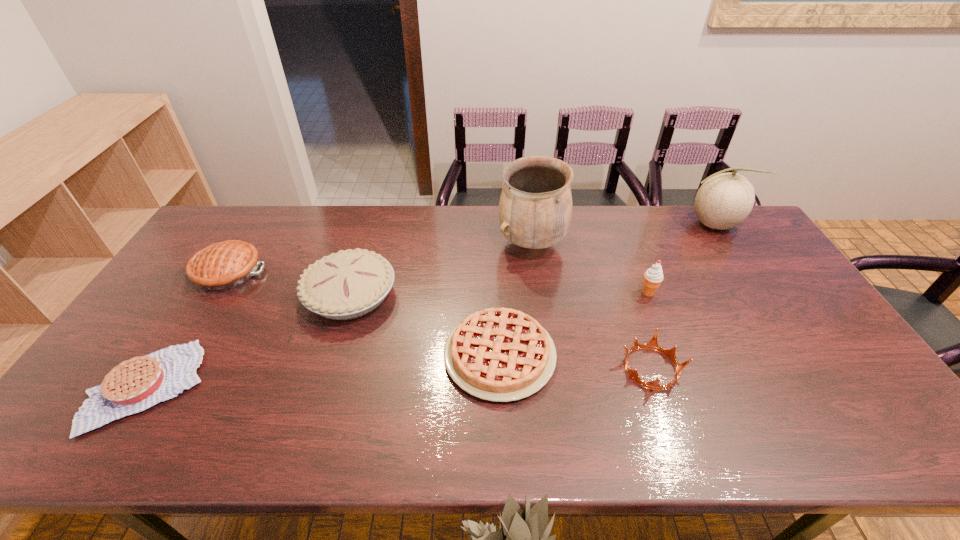
The height and width of the screenshot is (540, 960). I want to click on urn, so click(x=535, y=208).

This screenshot has height=540, width=960. Find the location of `the rightmost object`. the rightmost object is located at coordinates (724, 200).

You are a GUI agent. You are given a task and a screenshot of the screen. Output one action in this format:
    pyautogui.click(x=<x>, y=<y>)
    Task: Click on the icecream
    The image size is (960, 540).
    Given the screenshot: What is the action you would take?
    pyautogui.click(x=653, y=277)

The image size is (960, 540). I want to click on the second pie from right to left, so click(348, 284).

Find the location of a particular element. The image size is (960, 540). the third shortest pie is located at coordinates (222, 266).

Image resolution: width=960 pixels, height=540 pixels. I want to click on the third shortest object, so click(652, 344).

The width and height of the screenshot is (960, 540). Identify the location of the rightmost pie. (x=497, y=354).

Where is `the third tallest pie`? This screenshot has height=540, width=960. the third tallest pie is located at coordinates (497, 354).

I want to click on the shortest object, so click(x=137, y=384).

Locate an element on the screen. The image size is (960, 540). free space located 0.090m on the back of the urn is located at coordinates (527, 210).